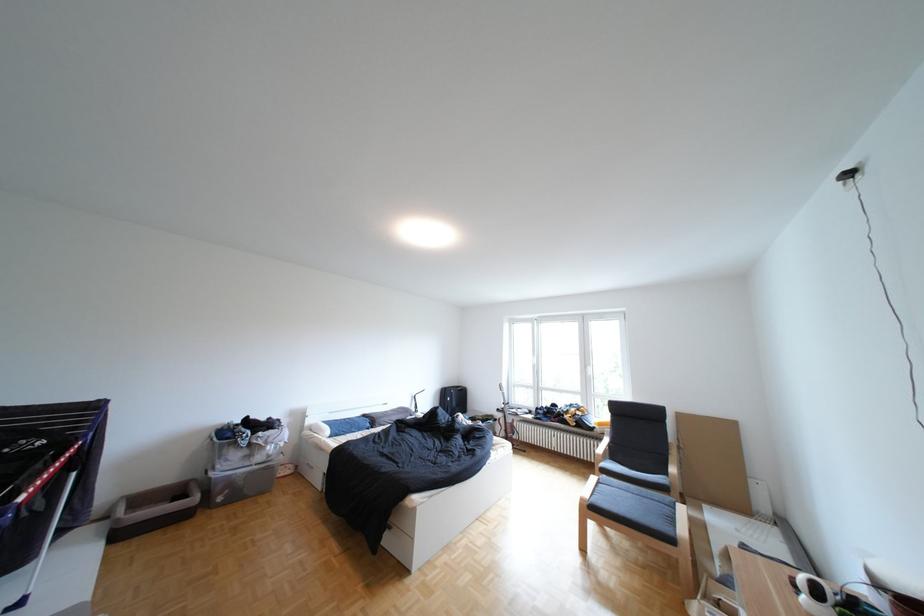
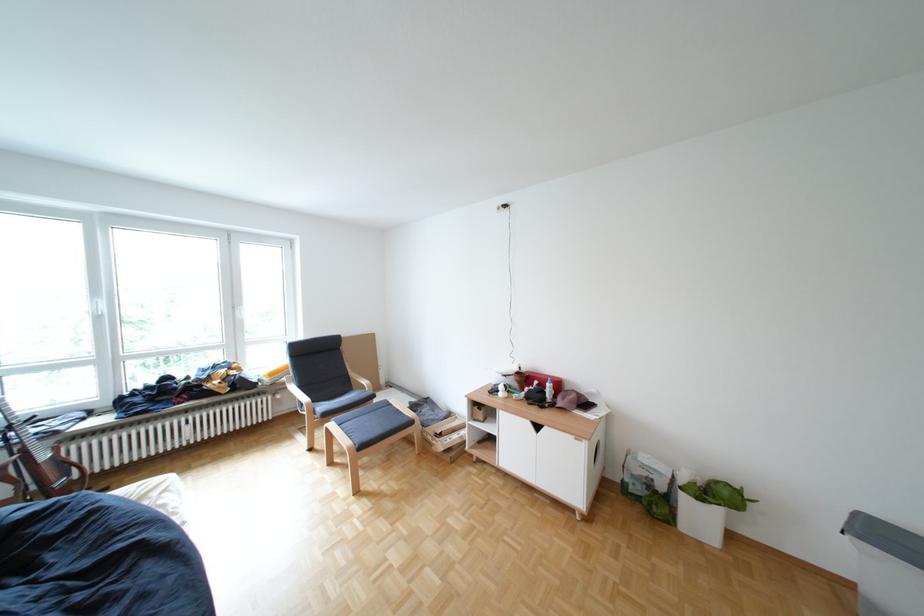
Question: I am providing you with two images of the same scene from different viewpoints. After the viewpoint changes to image2, which objects are now occluded?

Choices:
 (A) white spray bottle
 (B) white storage bin
 (C) chair sitting surface
 (D) none of these

Answer: (D)